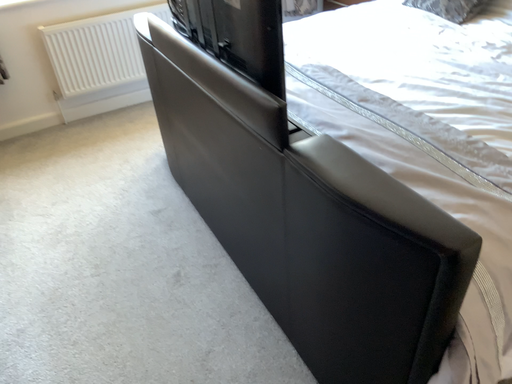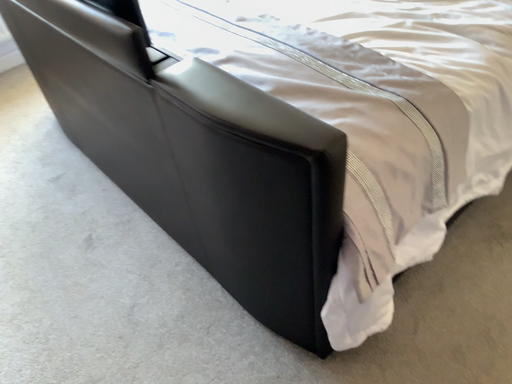
Question: How did the camera likely rotate when shooting the video?

Choices:
 (A) rotated right
 (B) rotated left

Answer: (A)